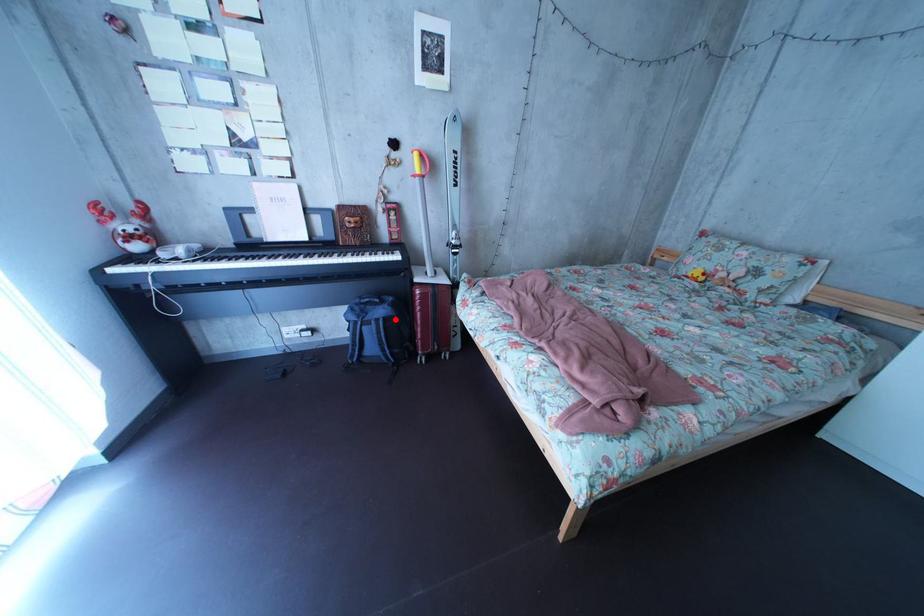
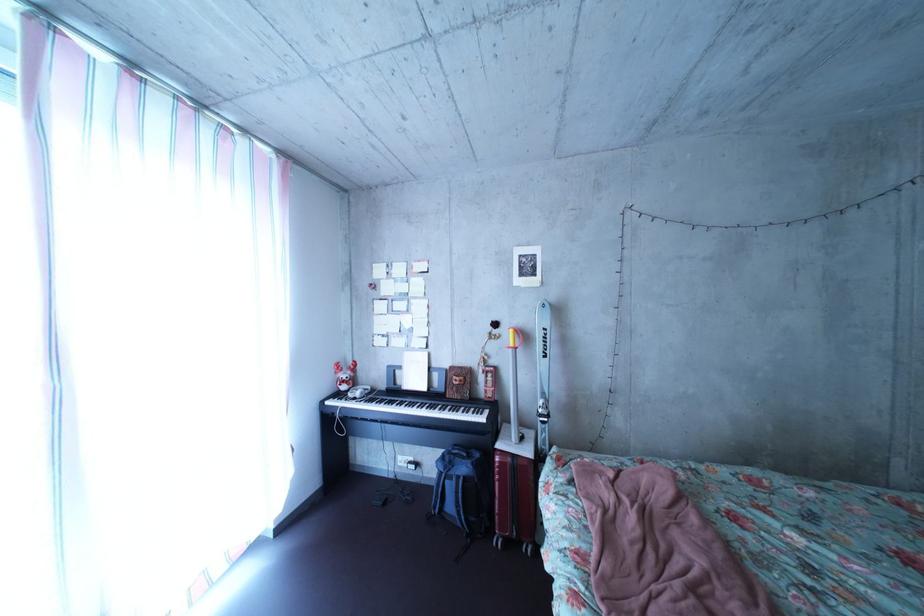
Find the pixel in the second image that matches the highlighted location in the first image.

(479, 477)